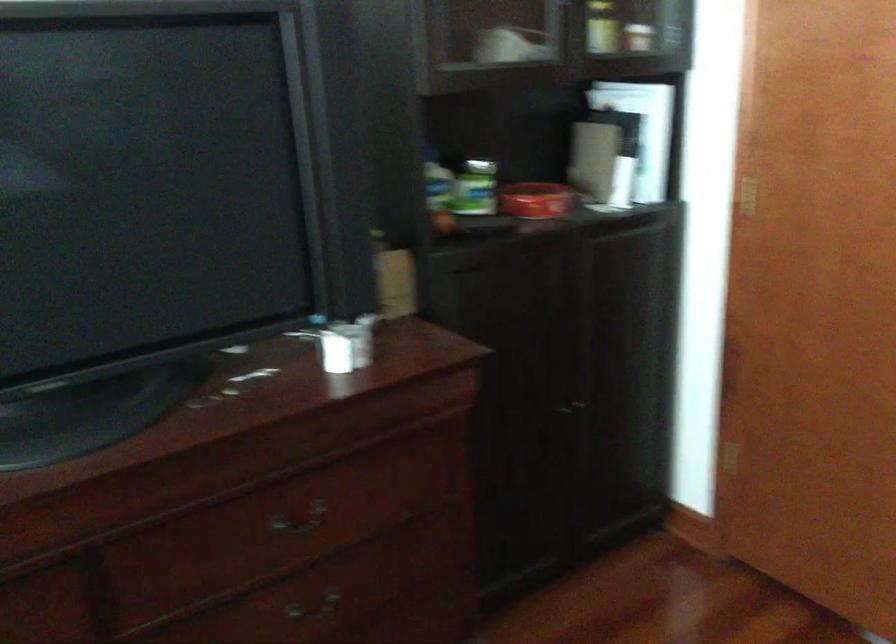
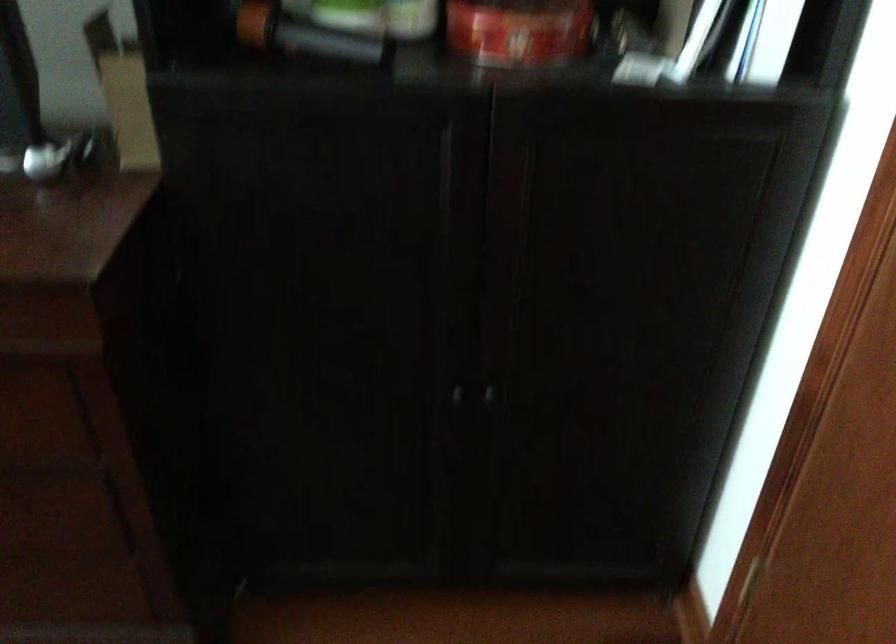
In the second image, find the point that corresponds to point (553, 204) in the first image.

(519, 31)